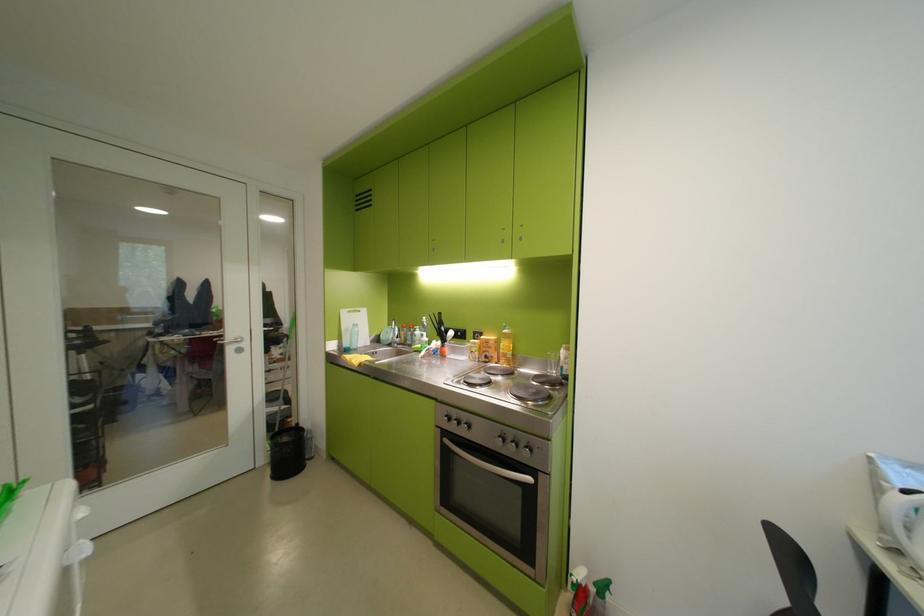
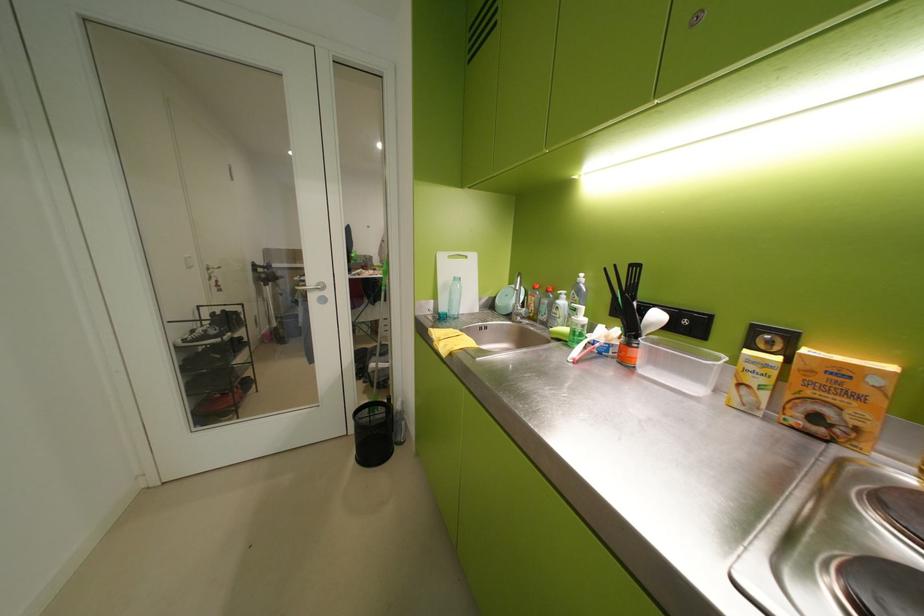
The point at (484, 334) is marked in the first image. Where is the corresponding point in the second image?

(767, 331)